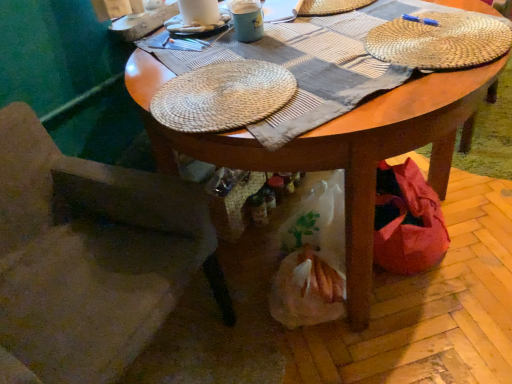
Find the location of a particular element. Image resolution: width=512 pixels, height=384 pixels. vacant area that is situated to the right of woven straw placemat at center, which is the first hat in bottom-to-top order is located at coordinates (370, 69).